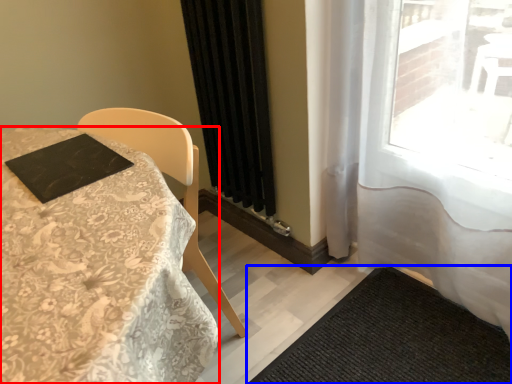
Question: Which object appears closest to the camera in this image, table (highlighted by a red box) or doormat (highlighted by a blue box)?

Choices:
 (A) table
 (B) doormat

Answer: (A)